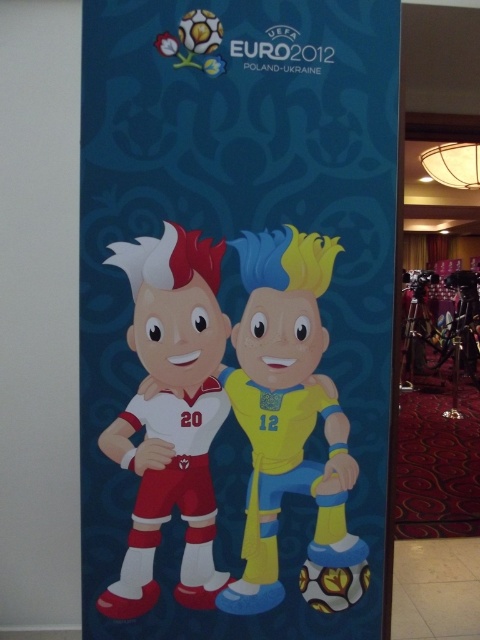
You are a collector who wants to display both the glossy paper poster at center and the matte white jersey at center on a wall. Since you want to emphasize the poster, does its size help in making it the focal point?

The glossy paper poster at center has a larger size compared to the matte white jersey at center, so yes, its larger size will naturally draw more attention and serve as the focal point.

You are an art curator examining the UEFA Euro 2012 promotional poster. You notice the glossy paper poster at center and the yellow matte soccer ball at center. Which object is placed above the other?

The glossy paper poster at center is positioned over the yellow matte soccer ball at center, meaning it is above the soccer ball.